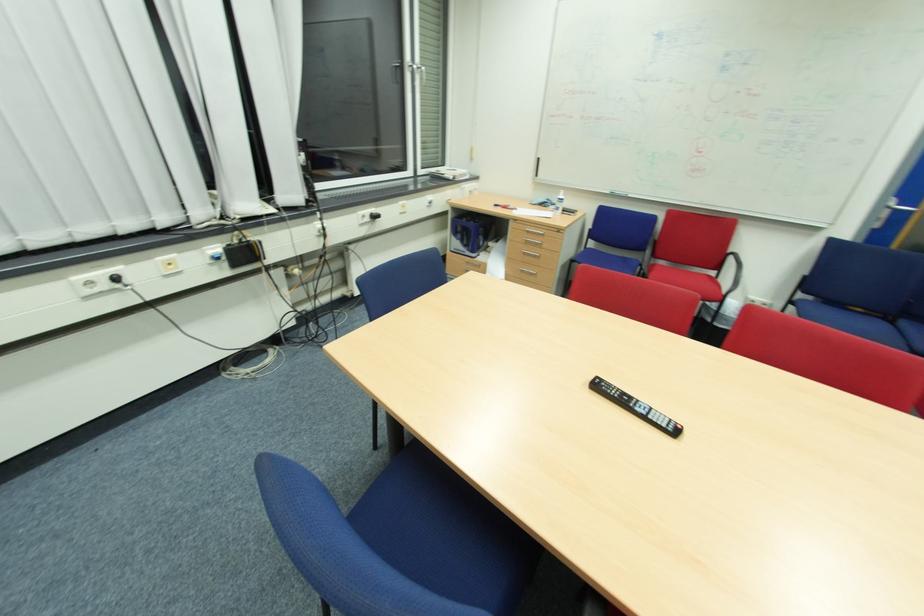
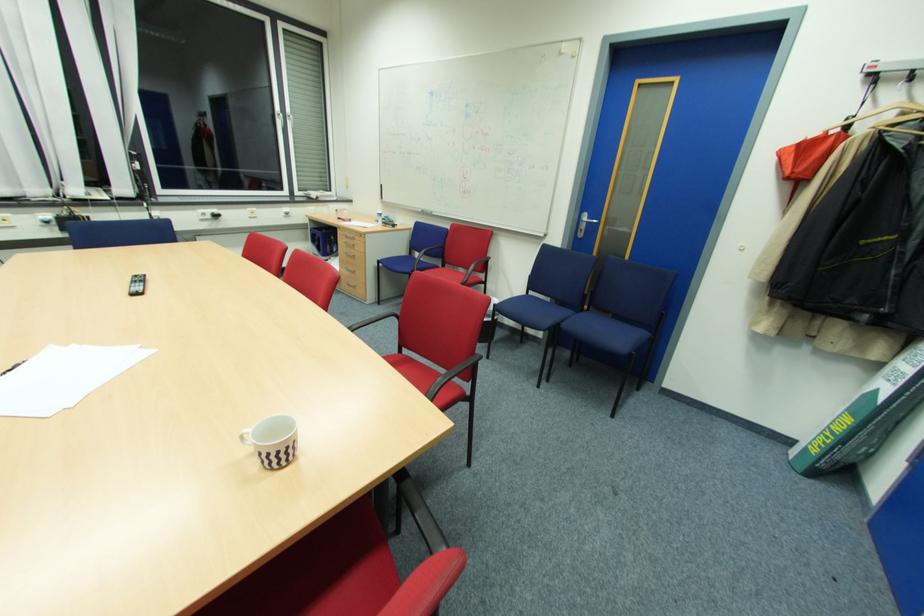
Question: In a continuous first-person perspective shot, in which direction is the camera moving?

Choices:
 (A) Left
 (B) Right
 (C) Forward
 (D) Backward

Answer: (B)